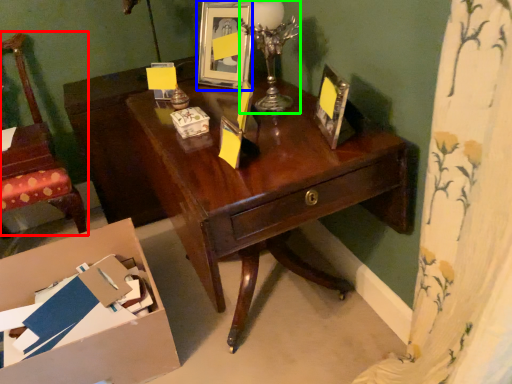
Question: Which object is the closest to the chair (highlighted by a red box)? Choose among these: picture frame (highlighted by a blue box) or candle holder (highlighted by a green box).

Choices:
 (A) picture frame
 (B) candle holder

Answer: (A)